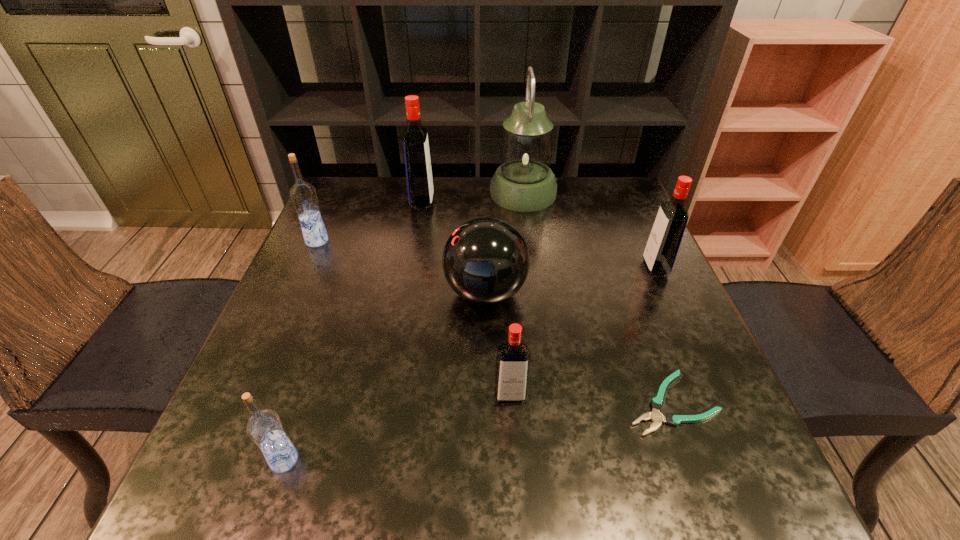
Where is `the second vodka from left to right`? the second vodka from left to right is located at coordinates (264, 427).

The image size is (960, 540). In order to click on the nearer blue vodka in this screenshot , I will do `click(264, 427)`.

This screenshot has height=540, width=960. In order to click on pliers in this screenshot , I will do `click(657, 403)`.

Locate an element on the screen. The image size is (960, 540). the shortest object is located at coordinates (657, 403).

At what (x,y) coordinates should I click in order to perform the action: click on vacant space situated on the front of the lantern. Please return your answer as a coordinate pair (x, y). Looking at the image, I should click on (528, 227).

Where is `free spot located 0.320m on the front and back of the farthest vodka`? free spot located 0.320m on the front and back of the farthest vodka is located at coordinates (545, 203).

Image resolution: width=960 pixels, height=540 pixels. In order to click on vacant space positioned on the front and back of the second smallest red vodka in this screenshot , I will do `click(581, 268)`.

You are a GUI agent. You are given a task and a screenshot of the screen. Output one action in this format:
    pyautogui.click(x=<x>, y=<y>)
    Task: Click on the free point located 0.170m on the front and back of the second smallest red vodka
    This screenshot has width=960, height=540.
    Given the screenshot: What is the action you would take?
    pyautogui.click(x=573, y=268)

The height and width of the screenshot is (540, 960). Find the location of `blank space located 0.270m on the front and back of the second smallest red vodka`. blank space located 0.270m on the front and back of the second smallest red vodka is located at coordinates (531, 268).

In order to click on free spot located 0.270m on the back of the leftmost vodka in this screenshot , I will do `click(344, 181)`.